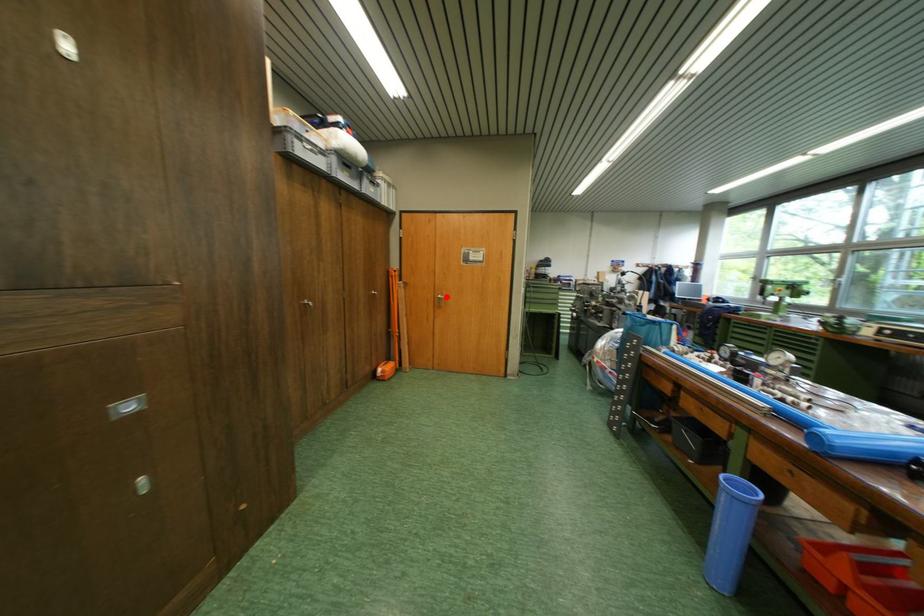
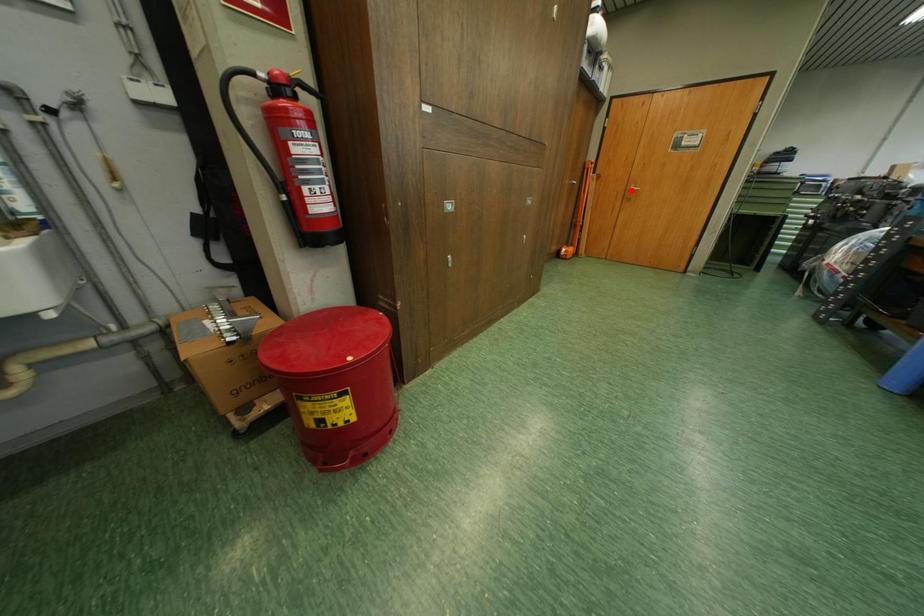
I am providing you with two images of the same scene from different viewpoints. A red point is marked on the first image and another point is marked on the second image. Do the highlighted points in image1 and image2 indicate the same real-world spot?

No